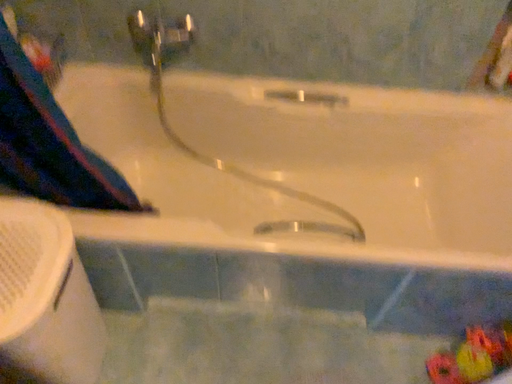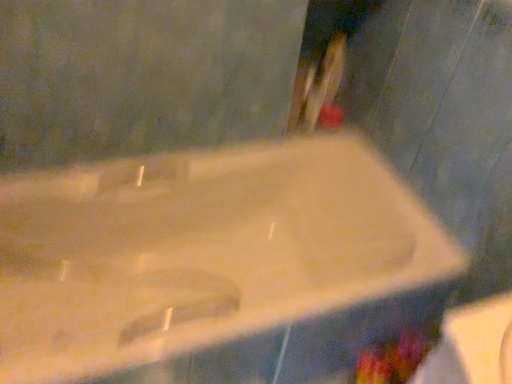
Question: How did the camera likely rotate when shooting the video?

Choices:
 (A) rotated left
 (B) rotated right

Answer: (B)